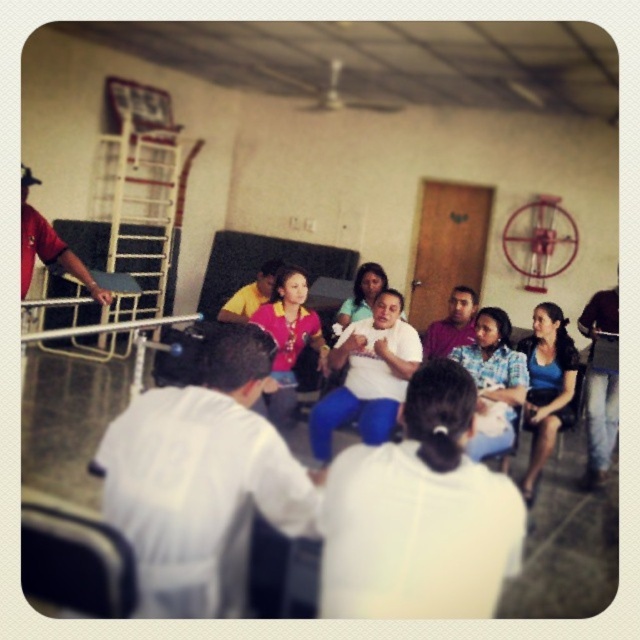
You are standing in the room and want to reach a specific point marked at coordinates point (456, 442). If you are currently 2 meters away from this point, how much closer do you need to move to be exactly at the point?

The distance of point (456, 442) from viewer is 1.54 meters. Since you are currently 2 meters away, you need to move 0.46 meters closer to reach the point.

You are organizing a photo shoot and need to arrange the matte pink shirt at center and yellow shirt at center based on their heights. Which one should you place in the back to ensure both are visible?

The matte pink shirt at center is much taller than the yellow shirt at center, so you should place the matte pink shirt at center in the back to ensure both are visible.